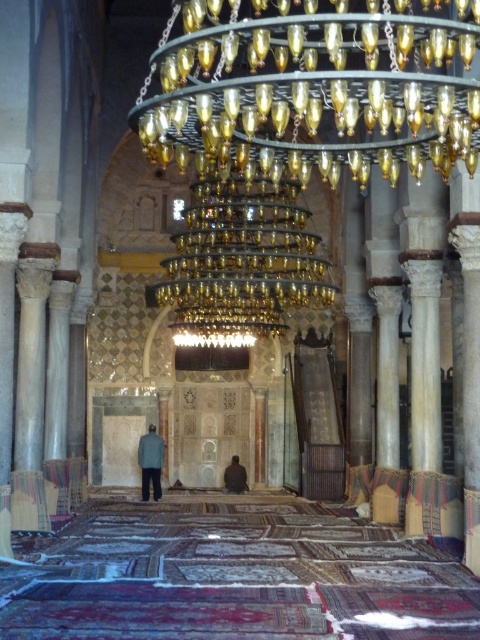
Is gray fabric person at center behind brown leather jacket at center?

No, it is not.

Does gray fabric person at center have a greater width compared to brown leather jacket at center?

Yes, gray fabric person at center is wider than brown leather jacket at center.

Does point (139, 456) come behind point (233, 480)?

No, it is in front of (233, 480).

What are the coordinates of `gray fabric person at center` in the screenshot? It's located at (151, 461).

Does point (457, 35) come farther from viewer compared to point (142, 440)?

No, (457, 35) is closer to viewer.

Describe the element at coordinates (315, 84) in the screenshot. I see `gold metallic chandelier at upper center` at that location.

Image resolution: width=480 pixels, height=640 pixels. What are the coordinates of `gold metallic chandelier at upper center` in the screenshot? It's located at (315, 84).

Find the location of a particular element. gold metallic chandelier at upper center is located at coordinates pos(315,84).

Between gold metallic chandelier at upper center and brown leather jacket at center, which one appears on the right side from the viewer's perspective?

Positioned to the right is gold metallic chandelier at upper center.

Can you confirm if gold metallic chandelier at upper center is smaller than brown leather jacket at center?

Actually, gold metallic chandelier at upper center might be larger than brown leather jacket at center.

Does point (418, 52) come in front of point (228, 480)?

Yes, it is in front of point (228, 480).

The height and width of the screenshot is (640, 480). Identify the location of gold metallic chandelier at upper center. (315, 84).